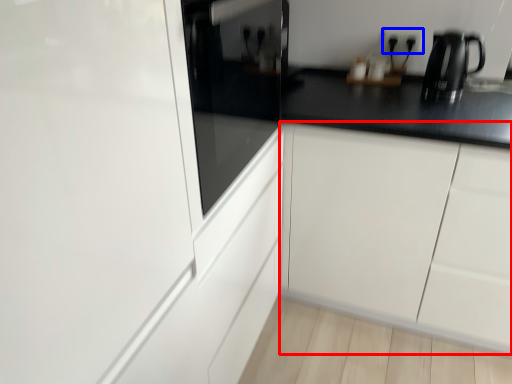
Question: Which point is further to the camera, cabinetry (highlighted by a red box) or electric outlet (highlighted by a blue box)?

Choices:
 (A) cabinetry
 (B) electric outlet

Answer: (B)